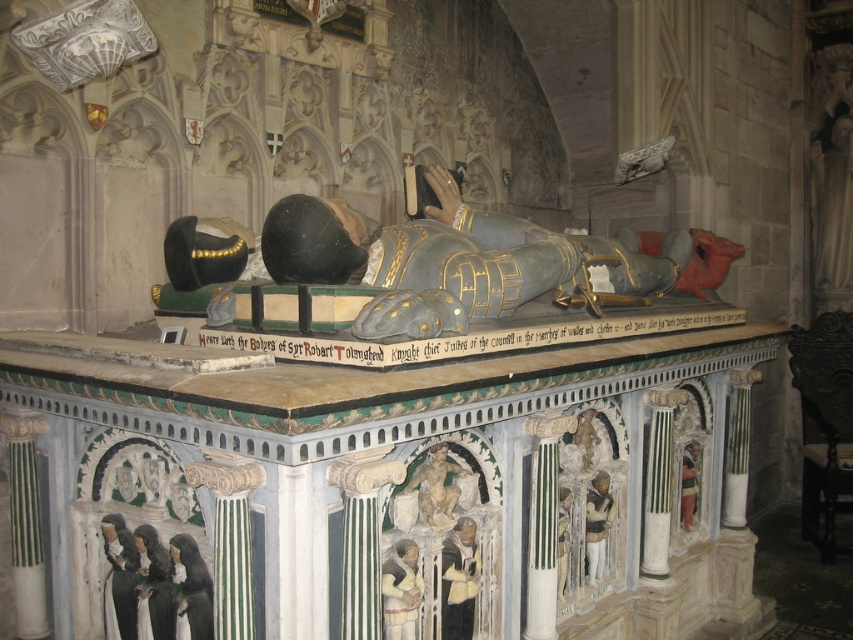
Question: Can you confirm if polished silver armor at center is smaller than stone figure at center?

Choices:
 (A) yes
 (B) no

Answer: (B)

Question: From the image, what is the correct spatial relationship of polished silver armor at center in relation to stone figure at center?

Choices:
 (A) right
 (B) left

Answer: (A)

Question: Is polished silver armor at center behind stone figure at center?

Choices:
 (A) yes
 (B) no

Answer: (B)